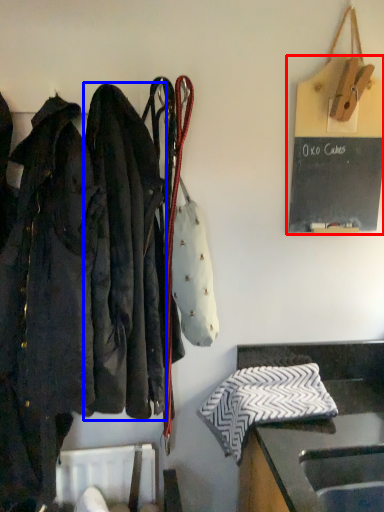
Question: Which object appears closest to the camera in this image, bulletin board (highlighted by a red box) or jacket (highlighted by a blue box)?

Choices:
 (A) bulletin board
 (B) jacket

Answer: (B)